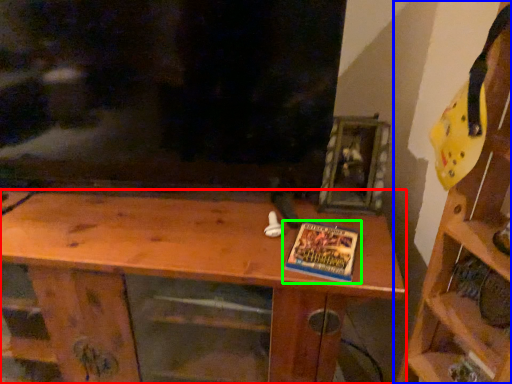
Question: Which object is the closest to the shelf (highlighted by a red box)? Choose among these: shelf (highlighted by a blue box) or book (highlighted by a green box).

Choices:
 (A) shelf
 (B) book

Answer: (B)